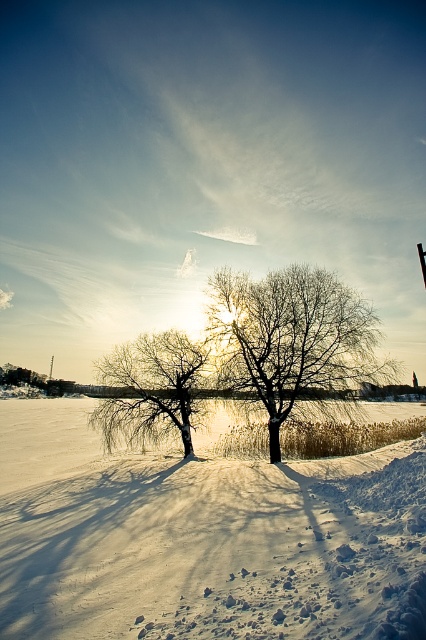
Question: Is white powdery snow at center bigger than bare wood tree at center?

Choices:
 (A) yes
 (B) no

Answer: (A)

Question: Is white powdery snow at center thinner than bare wood tree at center?

Choices:
 (A) no
 (B) yes

Answer: (A)

Question: Which point is closer to the camera?

Choices:
 (A) (123, 412)
 (B) (253, 324)

Answer: (B)

Question: Which is nearer to the white powdery snow at center?

Choices:
 (A) snow-covered tree at center
 (B) bare wood tree at center

Answer: (B)

Question: Is white powdery snow at center wider than bare wood tree at center?

Choices:
 (A) no
 (B) yes

Answer: (B)

Question: Among these objects, which one is farthest from the camera?

Choices:
 (A) white powdery snow at center
 (B) bare wood tree at center

Answer: (B)